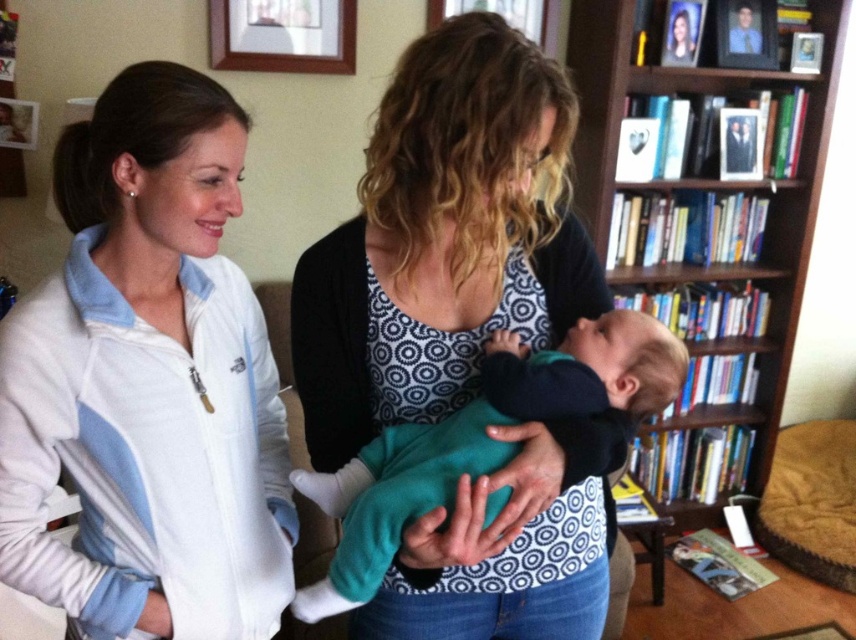
Based on the photo, you are an interior designer assessing the placement of items in the room. The brown wooden bookcase at upper right and the matte blue photo frame at upper right are both on the same wall. Which one is taller?

The brown wooden bookcase at upper right is taller than the matte blue photo frame at upper right.

In the scene shown: You are an interior designer planning to place a new large decorative item in the room. You notice the brown wooden bookcase at upper right and the wooden picture frame at upper center. Which object should you consider replacing if you want to make space for the new item, and why?

You should consider replacing the brown wooden bookcase at upper right because it is bigger than the wooden picture frame at upper center, making it the better candidate for removal to free up space.

You are a photographer trying to take a clear photo of the wooden picture frame at upper center. However, the brown wooden bookcase at upper right is blocking your view. Can you move the bookcase to get a clear shot?

The brown wooden bookcase at upper right is in front of the wooden picture frame at upper center, so moving it would allow you to see the frame clearly.